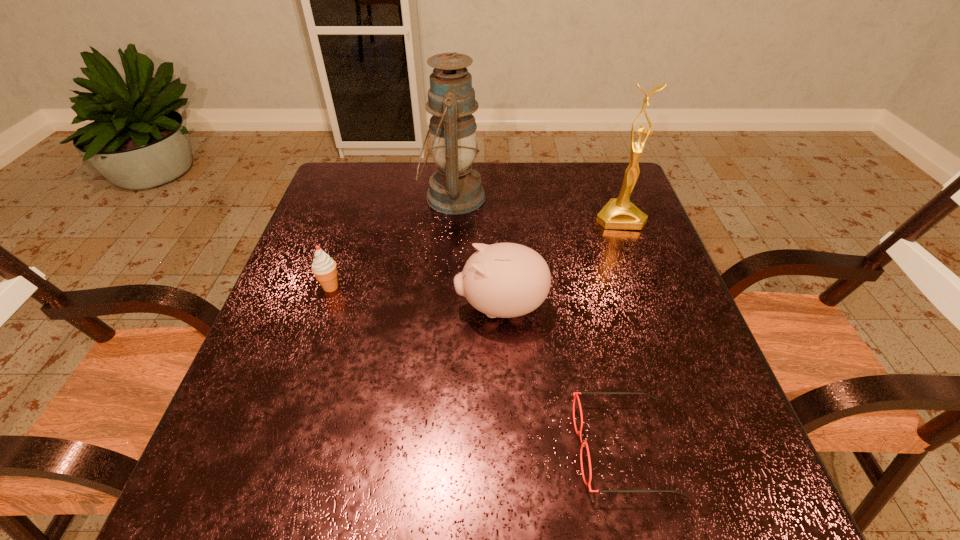
Image resolution: width=960 pixels, height=540 pixels. I want to click on object that stands as the third closest to the award, so click(x=575, y=394).

This screenshot has height=540, width=960. I want to click on vacant space that satisfies the following two spatial constraints: 1. on the front-facing side of the award; 2. at the snout of the third shortest object, so click(x=652, y=307).

You are a GUI agent. You are given a task and a screenshot of the screen. Output one action in this format:
    pyautogui.click(x=<x>, y=<y>)
    Task: Click on the vacant space that satisfies the following two spatial constraints: 1. on the back side of the oil lamp; 2. on the left side of the leftmost object
    The height and width of the screenshot is (540, 960).
    Given the screenshot: What is the action you would take?
    pyautogui.click(x=360, y=197)

This screenshot has width=960, height=540. I want to click on free space that satisfies the following two spatial constraints: 1. on the front-facing side of the award; 2. on the front-facing side of the spectacles, so click(703, 448).

I want to click on vacant space that satisfies the following two spatial constraints: 1. on the front-facing side of the award; 2. on the front-facing side of the nearest object, so click(703, 448).